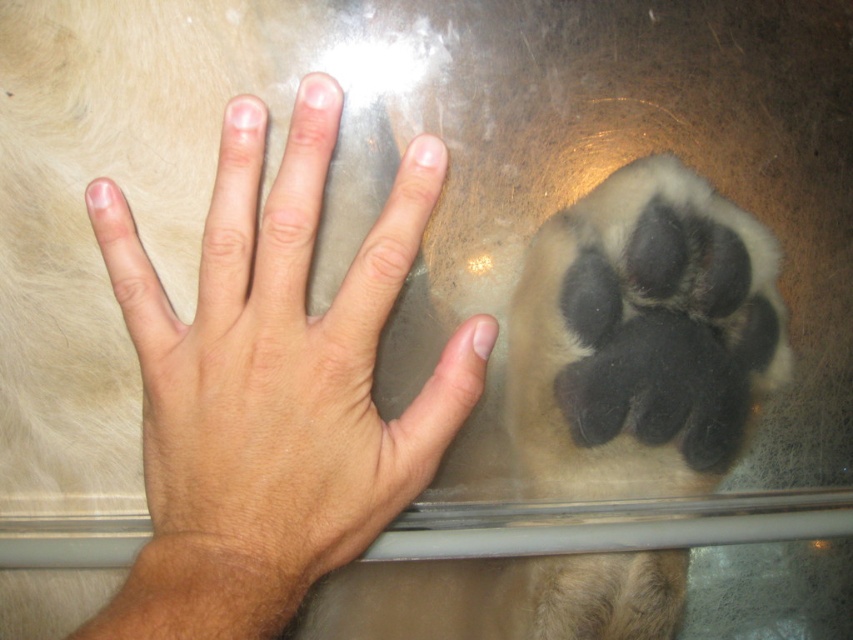
Question: Among these objects, which one is nearest to the camera?

Choices:
 (A) light skin tone flesh at center
 (B) soft fur paw at center

Answer: (A)

Question: Is the position of light skin tone flesh at center more distant than that of soft fur paw at center?

Choices:
 (A) no
 (B) yes

Answer: (A)

Question: Which point is farther to the camera?

Choices:
 (A) (297, 417)
 (B) (744, 394)

Answer: (B)

Question: Is light skin tone flesh at center positioned in front of soft fur paw at center?

Choices:
 (A) yes
 (B) no

Answer: (A)

Question: From the image, what is the correct spatial relationship of light skin tone flesh at center in relation to soft fur paw at center?

Choices:
 (A) below
 (B) above

Answer: (B)